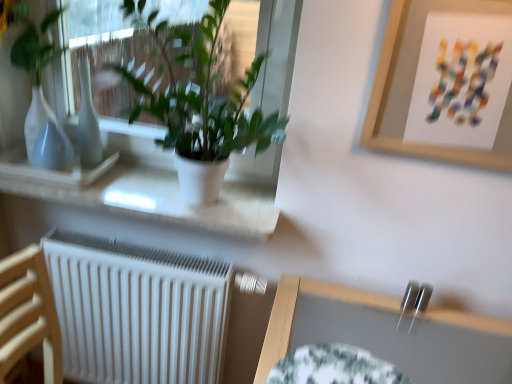
This screenshot has height=384, width=512. What are the coordinates of `blank space situated above white matte radiator at lower left (from a real-world perspective)` in the screenshot? It's located at (135, 252).